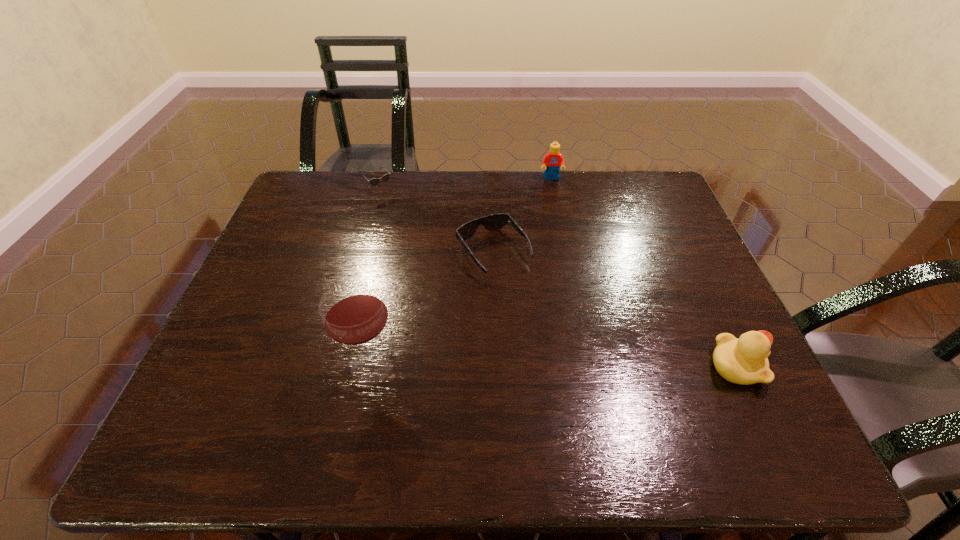
Image resolution: width=960 pixels, height=540 pixels. I want to click on free spot on the desktop that is between the wineglass and the duckling and is positioned on the front-facing side of the nearer sunglasses, so click(x=579, y=366).

The width and height of the screenshot is (960, 540). I want to click on free space on the desktop that is between the tallest object and the rightmost object and is positioned in front of the lenses of the farther sunglasses, so click(540, 367).

This screenshot has height=540, width=960. Identify the location of vacant spot on the desktop that is between the tallest object and the duckling and is positioned on the face of the Lego. [583, 366].